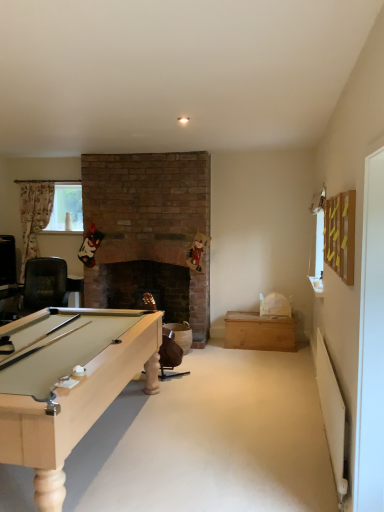
Question: From a real-world perspective, is clear plastic window screen at left positioned above or below light brown wood chest at center-right?

Choices:
 (A) below
 (B) above

Answer: (B)

Question: From the image's perspective, is clear plastic window screen at left positioned above or below light brown wood chest at center-right?

Choices:
 (A) above
 (B) below

Answer: (A)

Question: Is clear plastic window screen at left situated inside light brown wood chest at center-right or outside?

Choices:
 (A) outside
 (B) inside

Answer: (A)

Question: From a real-world perspective, is light brown wood chest at center-right positioned above or below clear plastic window screen at left?

Choices:
 (A) above
 (B) below

Answer: (B)

Question: Would you say light brown wood chest at center-right is inside or outside clear plastic window screen at left?

Choices:
 (A) inside
 (B) outside

Answer: (B)

Question: Visually, is light brown wood chest at center-right positioned to the left or to the right of clear plastic window screen at left?

Choices:
 (A) right
 (B) left

Answer: (A)

Question: Is light brown wood chest at center-right bigger or smaller than clear plastic window screen at left?

Choices:
 (A) small
 (B) big

Answer: (B)